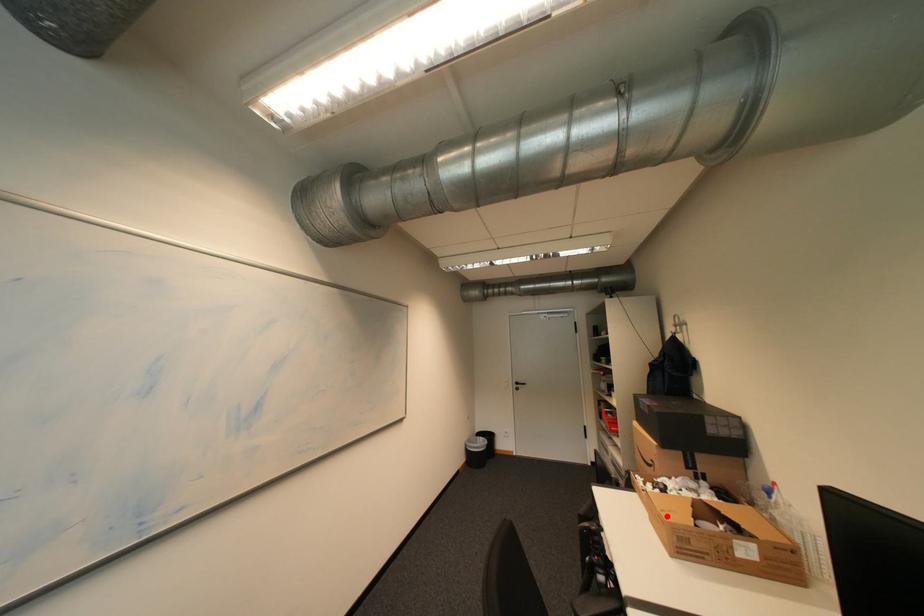
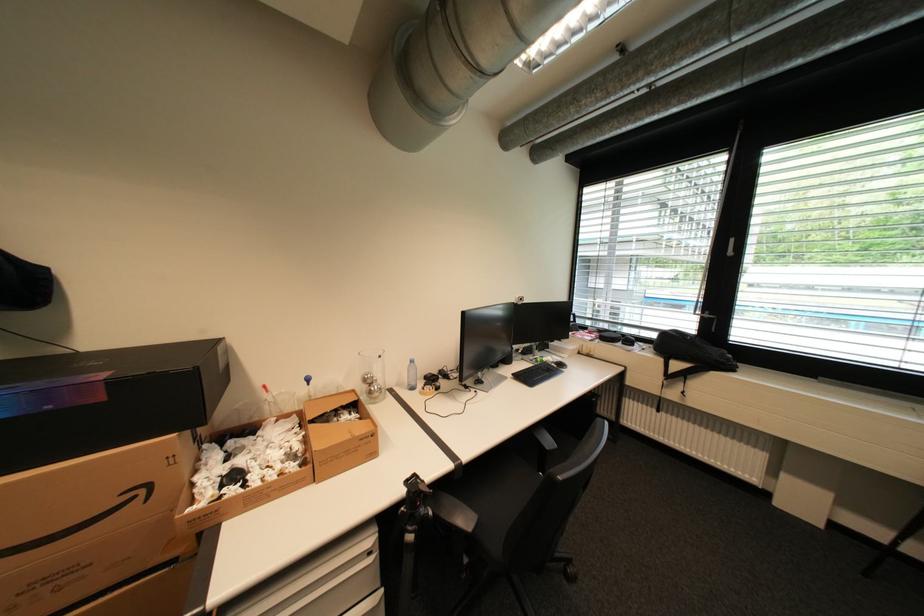
Locate, in the second image, the point that corresponds to the highlighted location in the first image.

(370, 440)